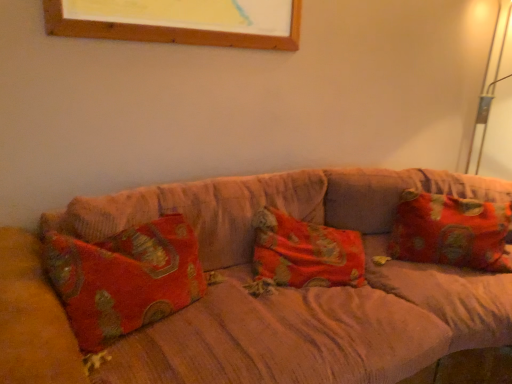
Question: Should I look upward or downward to see velvet-like beige couch at center?

Choices:
 (A) up
 (B) down

Answer: (B)

Question: Is floral fabric pillow at right facing away from velvet-like beige couch at center?

Choices:
 (A) no
 (B) yes

Answer: (B)

Question: Does floral fabric pillow at right have a greater height compared to velvet-like beige couch at center?

Choices:
 (A) yes
 (B) no

Answer: (B)

Question: From a real-world perspective, is floral fabric pillow at right positioned over velvet-like beige couch at center based on gravity?

Choices:
 (A) yes
 (B) no

Answer: (A)

Question: Is floral fabric pillow at right directly adjacent to velvet-like beige couch at center?

Choices:
 (A) yes
 (B) no

Answer: (B)

Question: From the image's perspective, does floral fabric pillow at right appear lower than velvet-like beige couch at center?

Choices:
 (A) yes
 (B) no

Answer: (B)

Question: Does floral fabric pillow at right have a greater width compared to velvet-like beige couch at center?

Choices:
 (A) no
 (B) yes

Answer: (A)

Question: Is velvet-like beige couch at center oriented towards floral fabric pillow at right?

Choices:
 (A) yes
 (B) no

Answer: (A)

Question: Is velvet-like beige couch at center to the left of floral fabric pillow at right from the viewer's perspective?

Choices:
 (A) no
 (B) yes

Answer: (B)

Question: Does velvet-like beige couch at center have a smaller size compared to floral fabric pillow at right?

Choices:
 (A) no
 (B) yes

Answer: (A)

Question: From a real-world perspective, does velvet-like beige couch at center stand above floral fabric pillow at right?

Choices:
 (A) no
 (B) yes

Answer: (A)

Question: From a real-world perspective, is velvet-like beige couch at center below floral fabric pillow at right?

Choices:
 (A) no
 (B) yes

Answer: (B)

Question: Considering the relative sizes of velvet-like beige couch at center and floral fabric pillow at right in the image provided, is velvet-like beige couch at center thinner than floral fabric pillow at right?

Choices:
 (A) yes
 (B) no

Answer: (B)

Question: Does point (456, 210) appear closer or farther from the camera than point (212, 241)?

Choices:
 (A) farther
 (B) closer

Answer: (A)